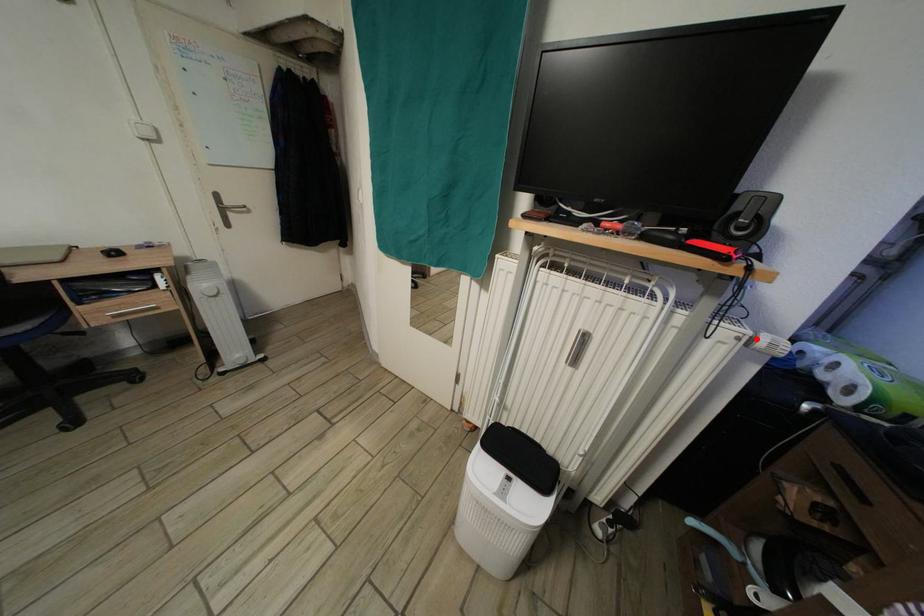
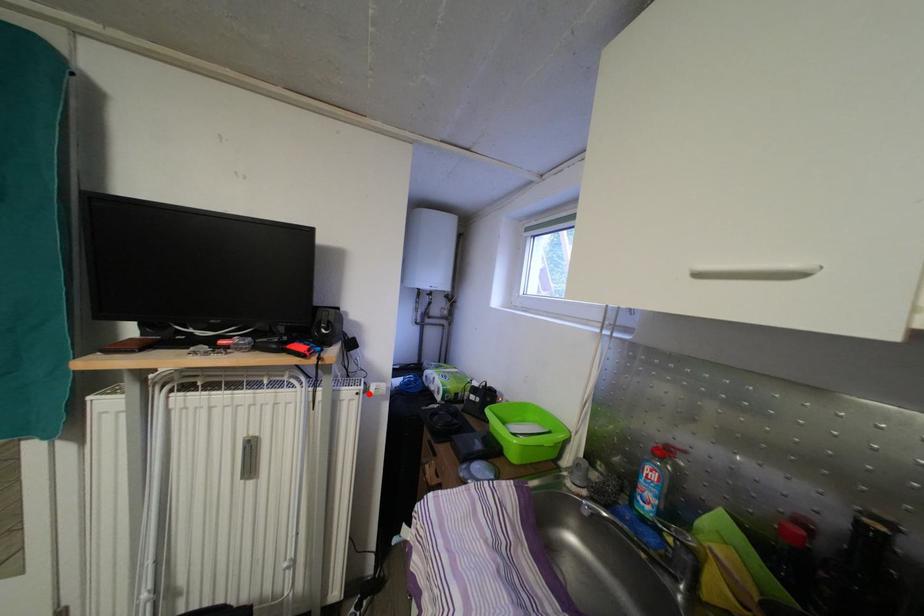
I am providing you with two images of the same scene from different viewpoints. A red point is marked on the first image and another point is marked on the second image. Does the point marked in image1 correspond to the same location as the one in image2?

Yes